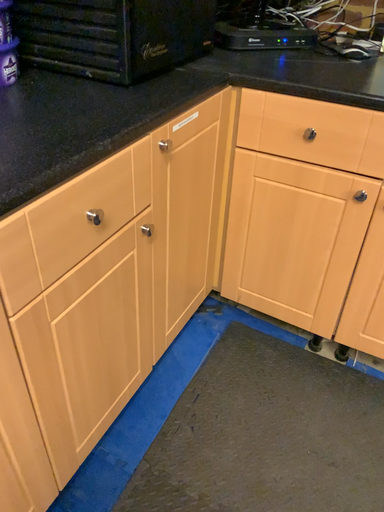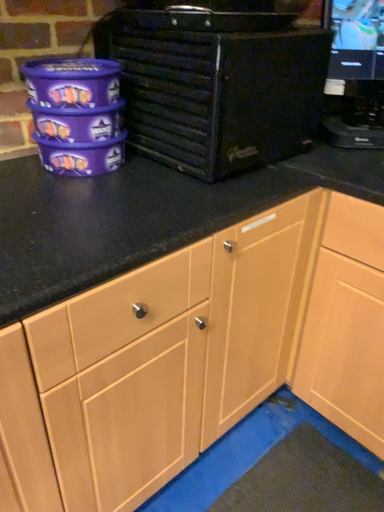
Question: How did the camera likely rotate when shooting the video?

Choices:
 (A) rotated upward
 (B) rotated downward

Answer: (A)